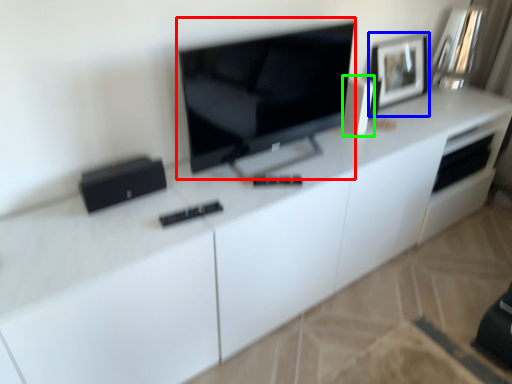
Question: Based on their relative distances, which object is nearer to television (highlighted by a red box)? Choose from picture frame (highlighted by a blue box) and appliance (highlighted by a green box).

Choices:
 (A) picture frame
 (B) appliance

Answer: (B)